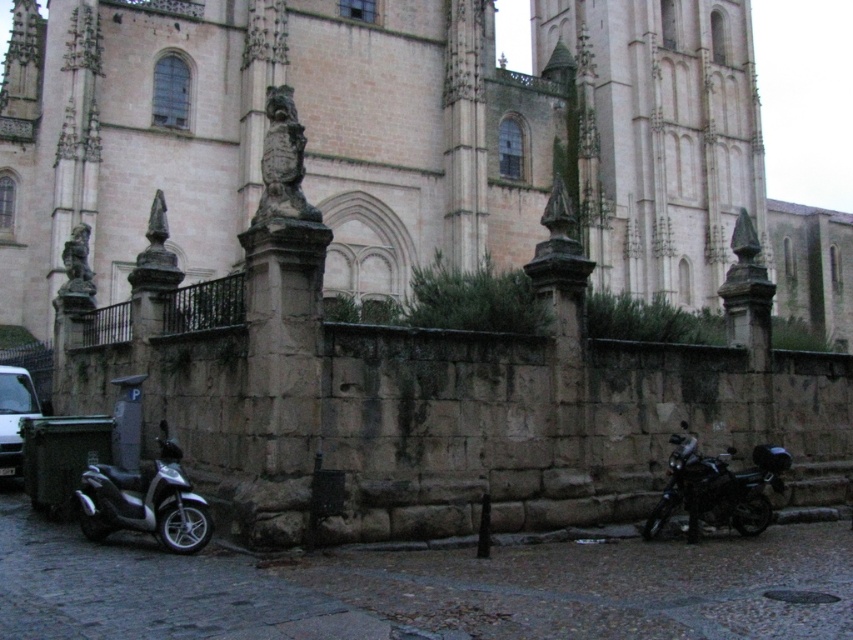
Question: Which object appears closest to the camera in this image?

Choices:
 (A) white matte van at lower left
 (B) silver metallic scooter at lower left
 (C) shiny black motorcycle at lower right

Answer: (B)

Question: Can you confirm if shiny black motorcycle at lower right is positioned to the right of white matte van at lower left?

Choices:
 (A) yes
 (B) no

Answer: (A)

Question: Which object is positioned closest to the white matte van at lower left?

Choices:
 (A) silver metallic scooter at lower left
 (B) shiny black motorcycle at lower right

Answer: (A)

Question: Is shiny black motorcycle at lower right smaller than white matte van at lower left?

Choices:
 (A) yes
 (B) no

Answer: (B)

Question: Is silver metallic scooter at lower left to the left of shiny black motorcycle at lower right from the viewer's perspective?

Choices:
 (A) yes
 (B) no

Answer: (A)

Question: Which object appears farthest from the camera in this image?

Choices:
 (A) white matte van at lower left
 (B) silver metallic scooter at lower left

Answer: (A)